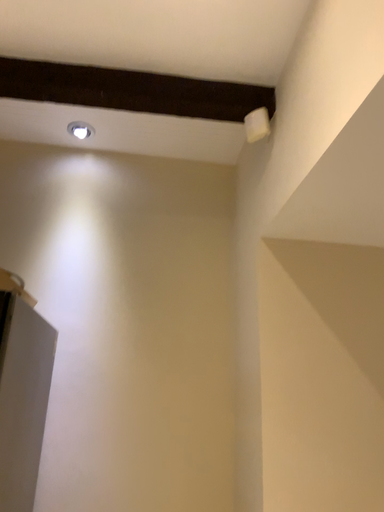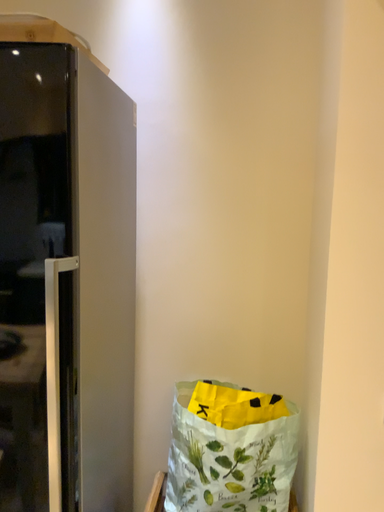
Question: Which way did the camera rotate in the video?

Choices:
 (A) rotated upward
 (B) rotated downward

Answer: (B)